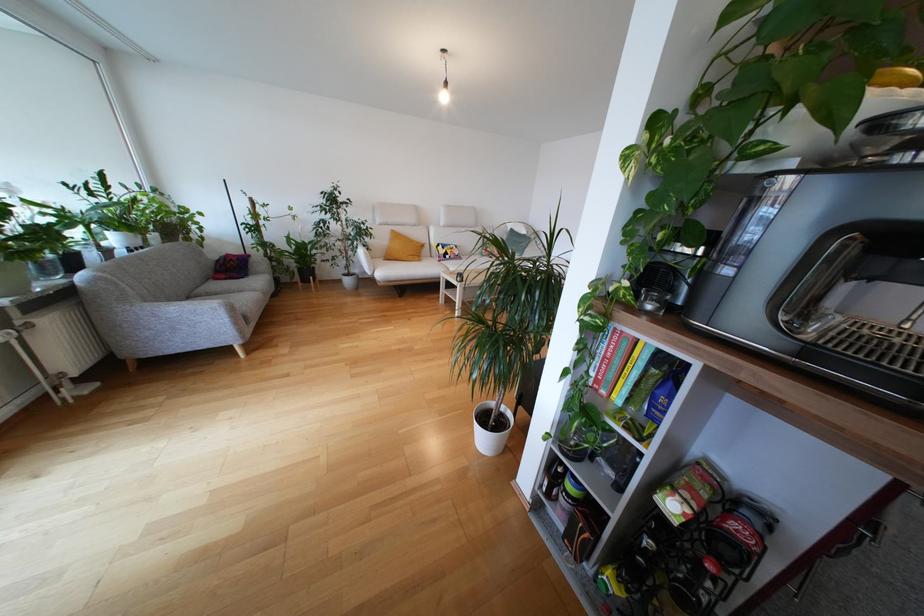
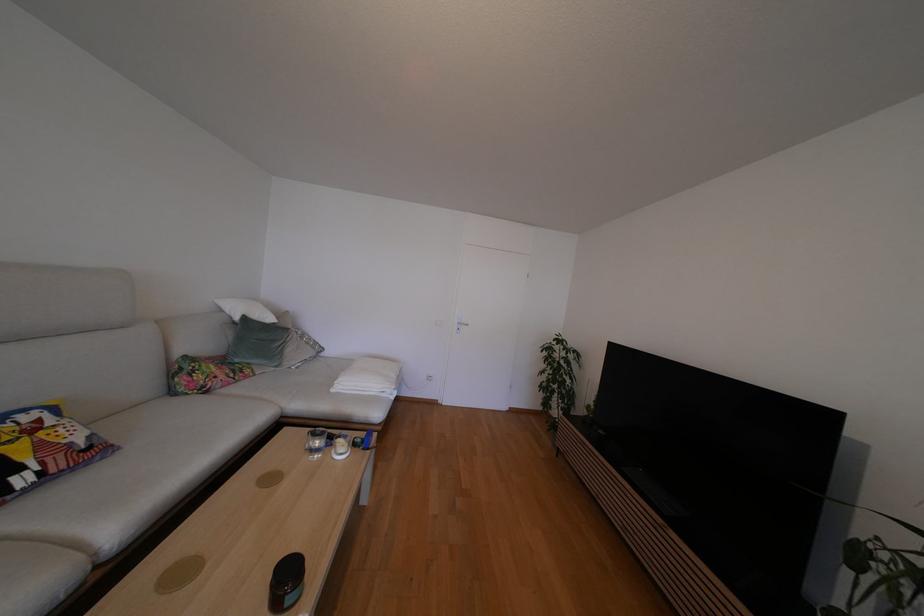
Locate, in the second image, the point that corresponds to (x=512, y=229) in the first image.

(227, 314)